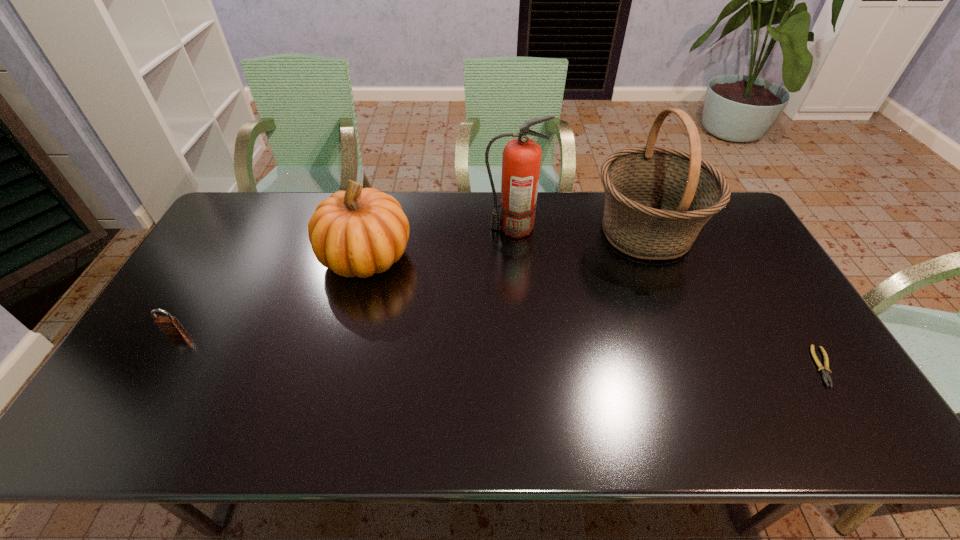
The height and width of the screenshot is (540, 960). In order to click on vacant space located on the nozzle of the third object from left to right in this screenshot , I will do `click(384, 228)`.

Where is `vacant space situated 0.160m on the nozzle of the third object from left to right`? Image resolution: width=960 pixels, height=540 pixels. vacant space situated 0.160m on the nozzle of the third object from left to right is located at coordinates (437, 228).

Identify the location of vacant area located 0.210m on the right of the pumpkin. (479, 256).

At what (x,y) coordinates should I click in order to perform the action: click on free space located 0.290m on the front-facing side of the fourth farthest object. Please return your answer as a coordinate pair (x, y). Looking at the image, I should click on (109, 441).

The height and width of the screenshot is (540, 960). Find the location of `vacant space located 0.090m on the front of the pliers`. vacant space located 0.090m on the front of the pliers is located at coordinates (859, 424).

Image resolution: width=960 pixels, height=540 pixels. I want to click on basket that is at the far edge, so click(657, 199).

Find the location of a particular element. The width and height of the screenshot is (960, 540). fire extinguisher situated at the far edge is located at coordinates (521, 160).

This screenshot has width=960, height=540. What are the coordinates of `pumpkin that is positioned at the far edge` in the screenshot? It's located at (358, 232).

This screenshot has width=960, height=540. Find the location of `object that is at the left edge`. object that is at the left edge is located at coordinates (169, 325).

At what (x,y) coordinates should I click in order to perform the action: click on basket at the right edge. Please return your answer as a coordinate pair (x, y). Image resolution: width=960 pixels, height=540 pixels. Looking at the image, I should click on (657, 199).